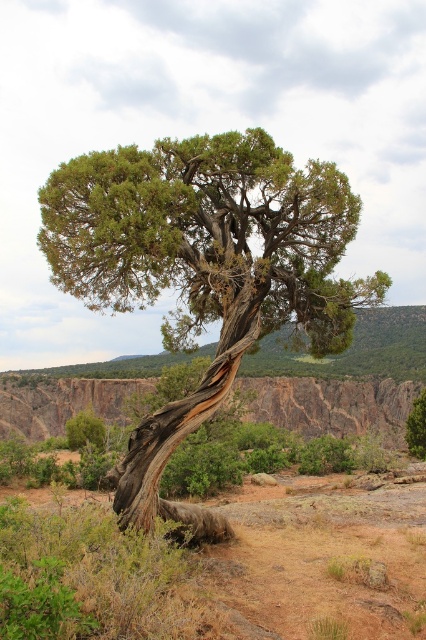
Question: Is green textured tree at center to the right of rusty rock cliff at center from the viewer's perspective?

Choices:
 (A) no
 (B) yes

Answer: (A)

Question: Observing the image, what is the correct spatial positioning of green textured tree at center in reference to rusty rock cliff at center?

Choices:
 (A) right
 (B) left

Answer: (B)

Question: Observing the image, what is the correct spatial positioning of green textured tree at center in reference to rusty rock cliff at center?

Choices:
 (A) left
 (B) right

Answer: (A)

Question: Among these objects, which one is nearest to the camera?

Choices:
 (A) rusty rock cliff at center
 (B) green textured tree at center

Answer: (B)

Question: Which object appears closest to the camera in this image?

Choices:
 (A) green textured tree at center
 (B) rusty rock cliff at center

Answer: (A)